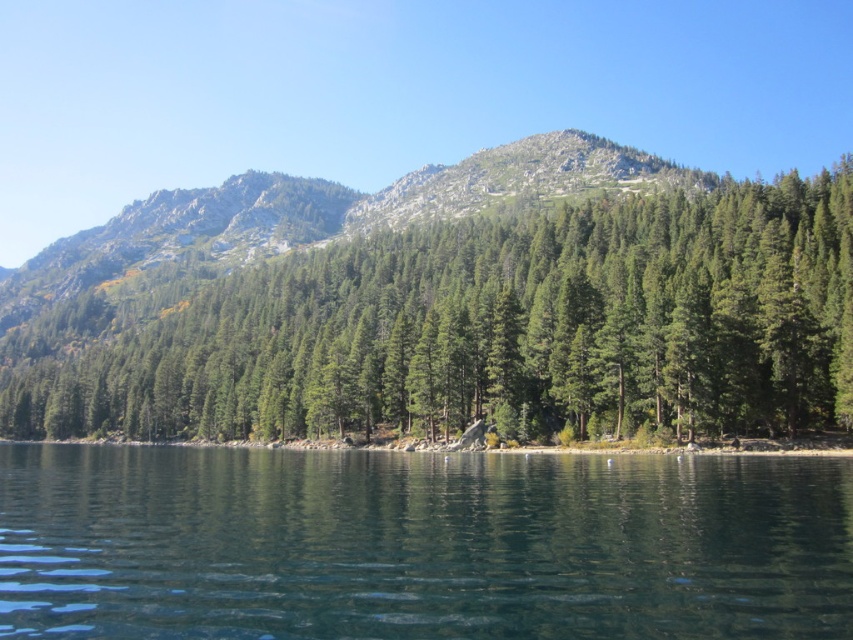
Is point (463, 266) closer to viewer compared to point (526, 164)?

Yes, point (463, 266) is closer to viewer.

Does green matte tree at center have a lesser width compared to green textured forest at center?

Yes, green matte tree at center is thinner than green textured forest at center.

Locate an element on the screen. This screenshot has width=853, height=640. green matte tree at center is located at coordinates [480, 328].

Image resolution: width=853 pixels, height=640 pixels. I want to click on green matte tree at center, so click(x=480, y=328).

Which of these two, green smooth water at center or green textured forest at center, stands taller?

Standing taller between the two is green textured forest at center.

Locate an element on the screen. green smooth water at center is located at coordinates (419, 545).

Is green matte tree at center to the right of green smooth water at center from the viewer's perspective?

Result: In fact, green matte tree at center is to the left of green smooth water at center.

Is green matte tree at center shorter than green smooth water at center?

In fact, green matte tree at center may be taller than green smooth water at center.

Is point (624, 273) positioned behind point (119, 605)?

That is True.

This screenshot has width=853, height=640. Find the location of `green matte tree at center`. green matte tree at center is located at coordinates (480, 328).